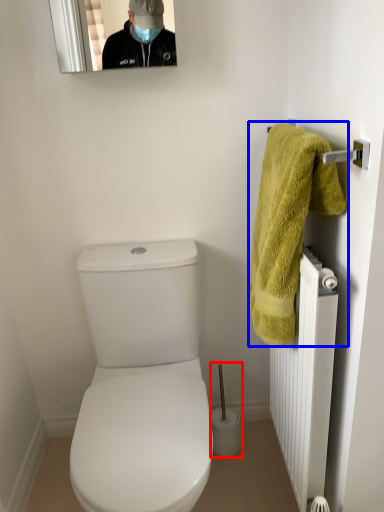
Question: Among these objects, which one is nearest to the camera, brush (highlighted by a red box) or towel (highlighted by a blue box)?

Choices:
 (A) brush
 (B) towel

Answer: (B)